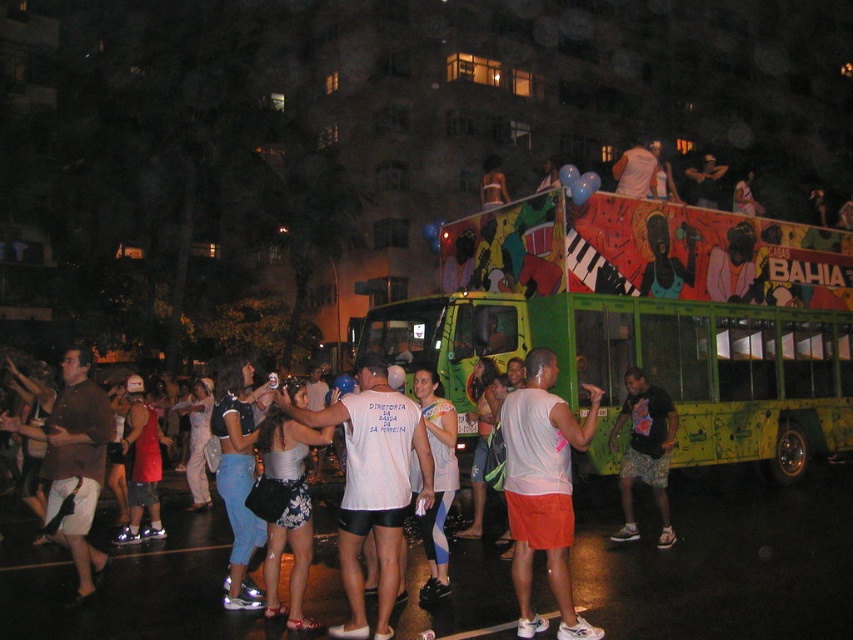
Question: Which point is farther to the camera?

Choices:
 (A) (444, 563)
 (B) (134, 410)

Answer: (B)

Question: Does white satin tank top at center come in front of denim shorts at center?

Choices:
 (A) yes
 (B) no

Answer: (A)

Question: Is orange cotton shorts at center wider than printed cotton shorts at center?

Choices:
 (A) yes
 (B) no

Answer: (A)

Question: Can you confirm if orange cotton shorts at center is positioned below white matte tank top at center?

Choices:
 (A) no
 (B) yes

Answer: (B)

Question: Considering the real-world distances, which object is farthest from the brown fabric shirt at left?

Choices:
 (A) shiny red shorts at center
 (B) white matte tank top at center
 (C) denim shorts at center
 (D) white satin tank top at center

Answer: (B)

Question: Considering the real-world distances, which object is closest to the green painted bus at center?

Choices:
 (A) white satin tank top at center
 (B) white matte shirt at center
 (C) shiny red shorts at center

Answer: (C)